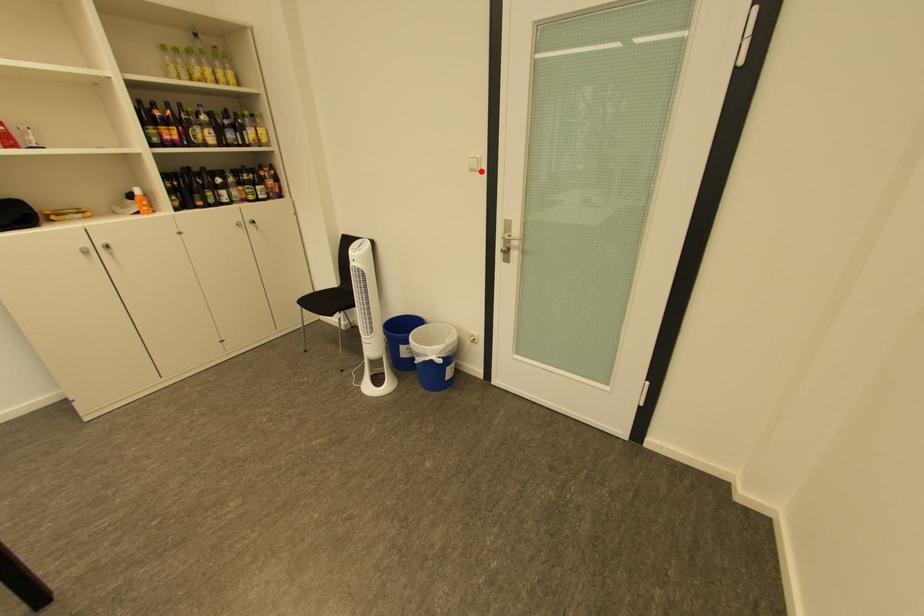
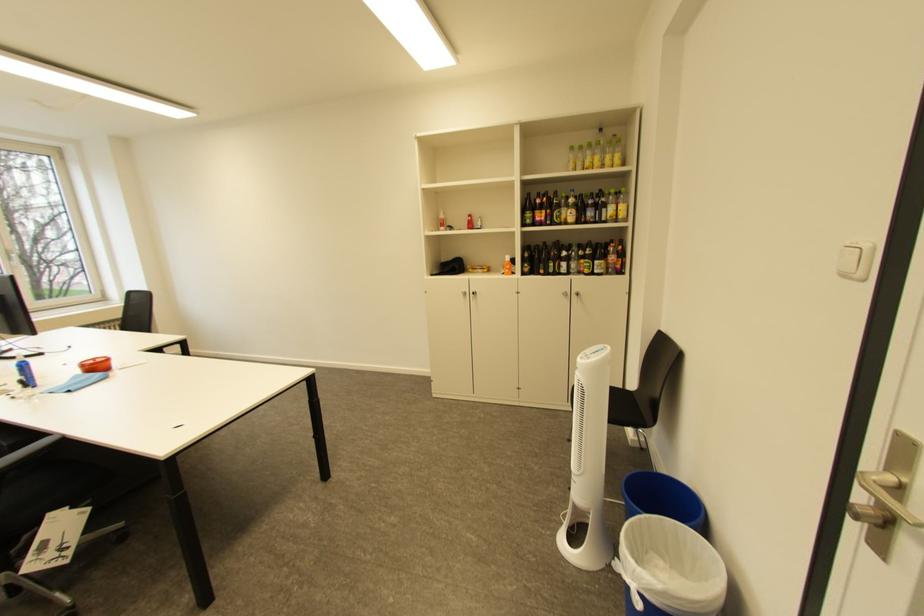
The point at the highlighted location is marked in the first image. Where is the corresponding point in the second image?

(855, 277)